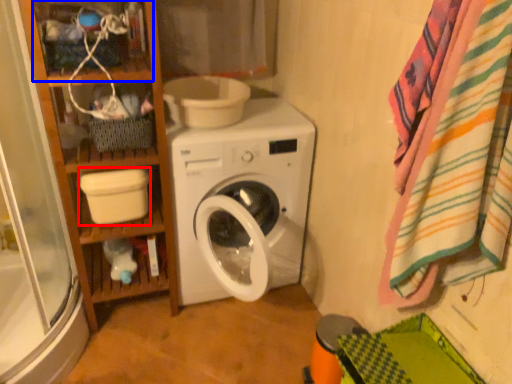
Question: Which object appears closest to the camera in this image, toilet bowl (highlighted by a red box) or shelf (highlighted by a blue box)?

Choices:
 (A) toilet bowl
 (B) shelf

Answer: (B)